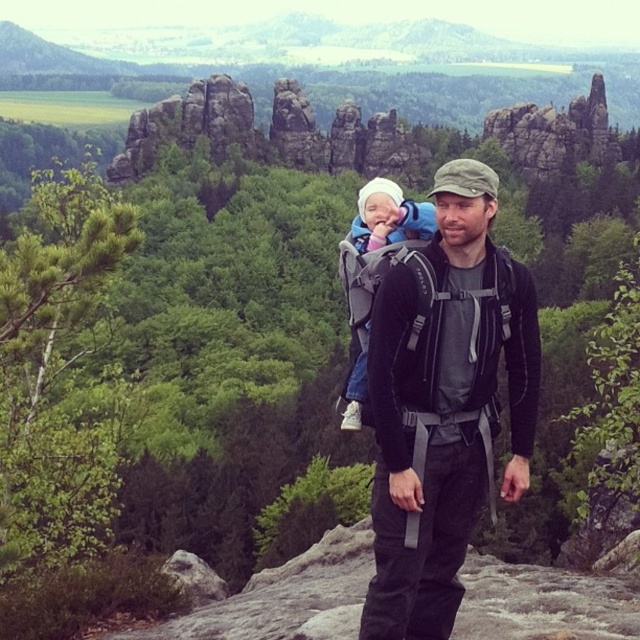
Who is lower down, black fabric backpack at center or white fleece baby carrier at center?

black fabric backpack at center

What do you see at coordinates (444, 403) in the screenshot?
I see `black fabric backpack at center` at bounding box center [444, 403].

Where is `black fabric backpack at center`? black fabric backpack at center is located at coordinates tap(444, 403).

Does black fabric backpack at center have a smaller size compared to white fleece baby at center?

Yes, black fabric backpack at center is smaller than white fleece baby at center.

In the scene shown: Does black fabric backpack at center have a greater height compared to white fleece baby at center?

No, black fabric backpack at center is not taller than white fleece baby at center.

Is point (417, 604) behind point (400, 221)?

No, (417, 604) is in front of (400, 221).

Locate an element on the screen. black fabric backpack at center is located at coordinates (444, 403).

Does white fleece baby carrier at center have a smaller size compared to white fleece baby at center?

No.

Measure the distance between white fleece baby carrier at center and camera.

white fleece baby carrier at center is 53.86 meters from camera.

Between point (353, 419) and point (380, 225), which one is positioned in front?

Point (353, 419)

The image size is (640, 640). In order to click on white fleece baby carrier at center in this screenshot , I will do `click(388, 218)`.